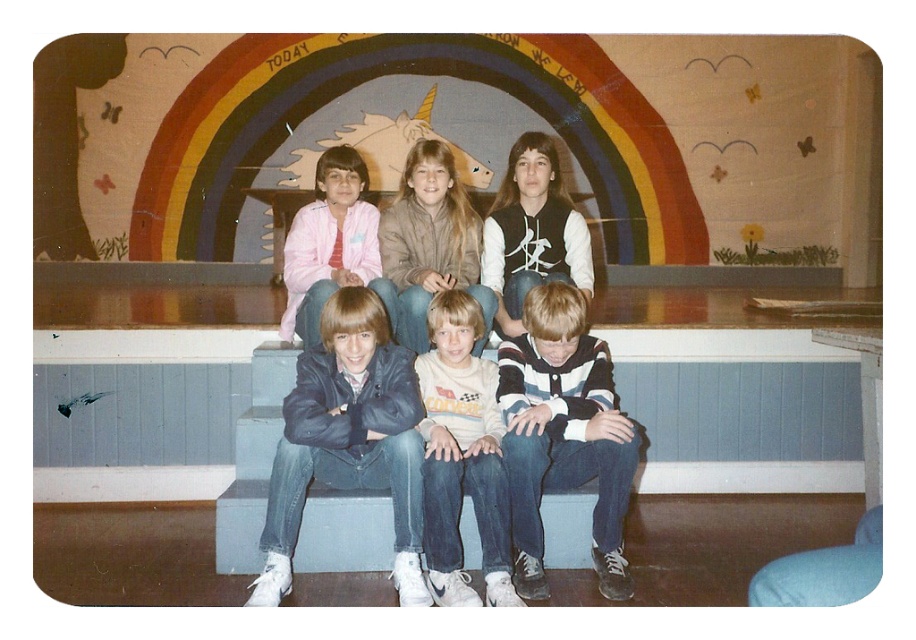
Can you confirm if white cotton shirt at center is positioned above pink fabric jacket at upper left?

Incorrect, white cotton shirt at center is not positioned above pink fabric jacket at upper left.

Does point (437, 586) come closer to viewer compared to point (333, 212)?

Yes, it is in front of point (333, 212).

Find the location of a particular element. Image resolution: width=916 pixels, height=640 pixels. white cotton shirt at center is located at coordinates (462, 456).

Does blue wood bench at center come behind light blue fabric at lower right?

Yes, blue wood bench at center is further from the viewer.

Is blue wood bench at center shorter than light blue fabric at lower right?

Incorrect, blue wood bench at center's height does not fall short of light blue fabric at lower right's.

This screenshot has height=640, width=916. In order to click on blue wood bench at center in this screenshot , I will do `click(149, 323)`.

Can you confirm if denim jeans at center is positioned above light brown suede jacket at center?

No, denim jeans at center is not above light brown suede jacket at center.

Is denim jeans at center below light brown suede jacket at center?

Indeed, denim jeans at center is positioned under light brown suede jacket at center.

You are a GUI agent. You are given a task and a screenshot of the screen. Output one action in this format:
    pyautogui.click(x=<x>, y=<y>)
    Task: Click on the denim jeans at center
    Image resolution: width=916 pixels, height=640 pixels.
    Given the screenshot: What is the action you would take?
    pyautogui.click(x=471, y=241)

This screenshot has height=640, width=916. Identify the location of denim jeans at center. (471, 241).